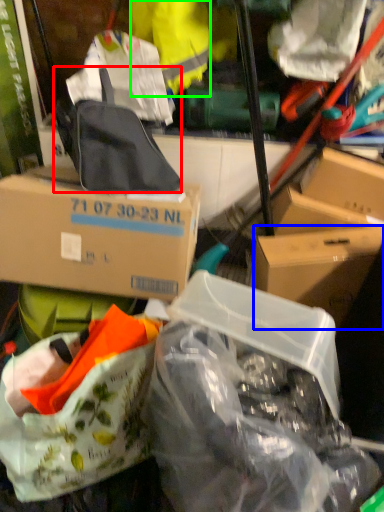
Question: Estimate the real-world distances between objects in this image. Which object is farther from backpack (highlighted by a red box), box (highlighted by a blue box) or clothing (highlighted by a green box)?

Choices:
 (A) box
 (B) clothing

Answer: (A)